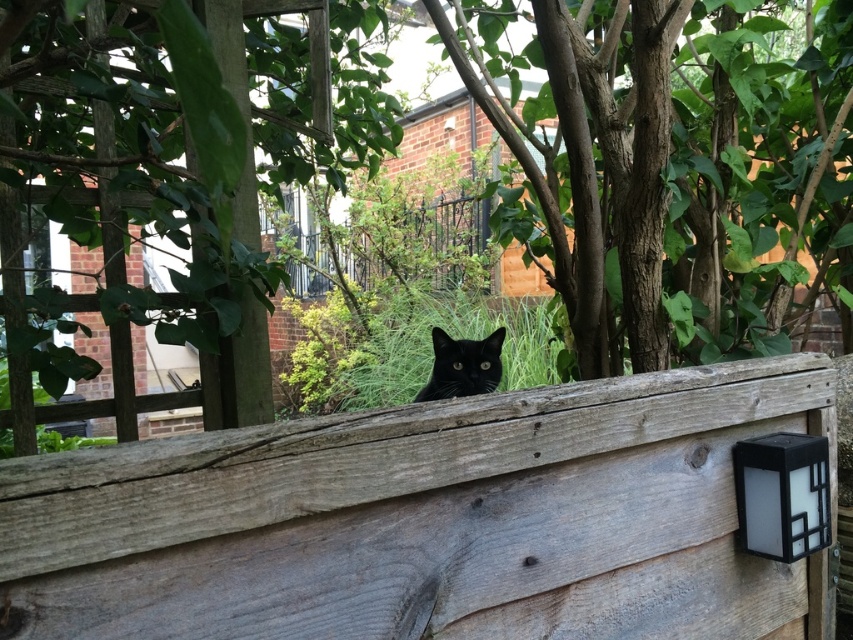
Where is `green leafy tree at center`? The width and height of the screenshot is (853, 640). green leafy tree at center is located at coordinates (666, 168).

Does point (560, 4) come closer to viewer compared to point (741, 492)?

No, it is not.

Locate an element on the screen. This screenshot has height=640, width=853. green leafy tree at center is located at coordinates (666, 168).

Does weathered wood fence at center appear on the right side of black matte cat at center?

Correct, you'll find weathered wood fence at center to the right of black matte cat at center.

Is point (381, 561) closer to camera compared to point (479, 358)?

Yes, it is in front of point (479, 358).

The image size is (853, 640). What are the coordinates of `weathered wood fence at center` in the screenshot? It's located at (426, 520).

Is point (276, 86) less distant than point (679, 522)?

No, it is behind (679, 522).

Can you confirm if green leafy tree at center is positioned below weathered wood fence at center?

Actually, green leafy tree at center is above weathered wood fence at center.

Between point (633, 84) and point (495, 520), which one is positioned in front?

Point (495, 520) is more forward.

Locate an element on the screen. green leafy tree at center is located at coordinates (666, 168).